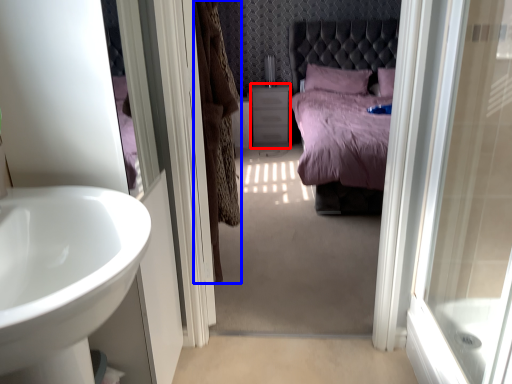
Question: Among these objects, which one is farthest to the camera, vanity (highlighted by a red box) or curtain (highlighted by a blue box)?

Choices:
 (A) vanity
 (B) curtain

Answer: (A)